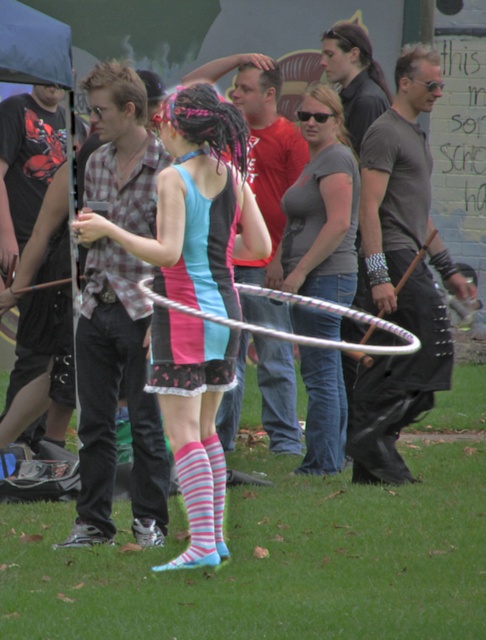
Question: Which point is closer to the camera?

Choices:
 (A) (317, 417)
 (B) (278, 547)
 (C) (262, 326)
 (D) (169, 212)

Answer: (D)

Question: Which of these objects is positioned closest to the jeans at center?

Choices:
 (A) metallic silver hula hoop at center
 (B) green grass at lower center

Answer: (A)

Question: Can you confirm if pink fabric dress at center is positioned below metallic silver hula hoop at center?

Choices:
 (A) yes
 (B) no

Answer: (A)

Question: Is green grass at lower center above pink fabric dress at center?

Choices:
 (A) no
 (B) yes

Answer: (A)

Question: Can you confirm if green grass at lower center is wider than matte gray shirt at center?

Choices:
 (A) no
 (B) yes

Answer: (B)

Question: Considering the real-world distances, which object is closest to the metallic silver hula hoop at center?

Choices:
 (A) matte gray shirt at center
 (B) pink fabric skirt at center
 (C) pink fabric dress at center

Answer: (C)